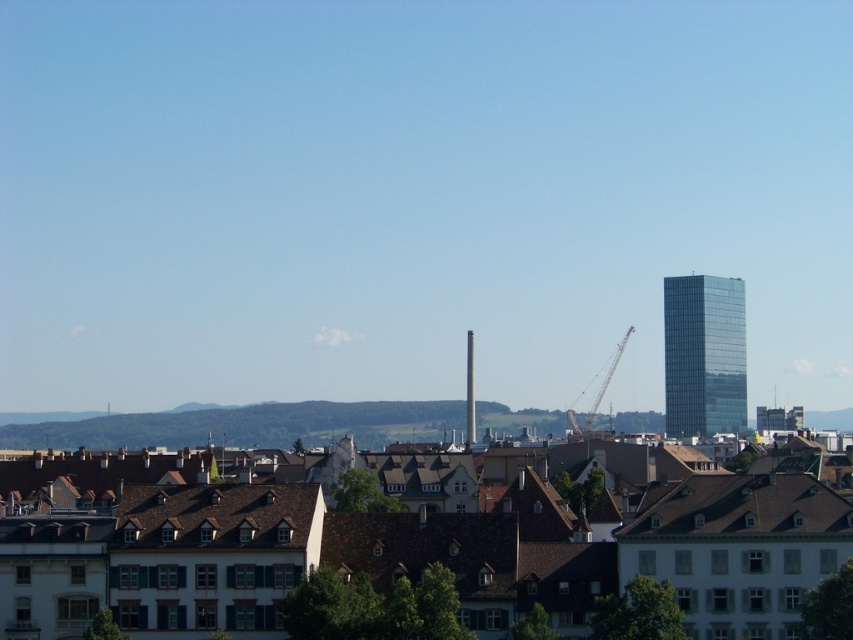
You are an architect planning to install a new billboard between the green glass tower at right and the metallic gray crane at center. Given their widths, which object should the billboard be closer to to ensure it doesn

The green glass tower at right has a lesser width compared to the metallic gray crane at center. Therefore, the billboard should be closer to the metallic gray crane at center to accommodate its larger width.

Based on the photo, what is located at the coordinates point (704,355)?

The green glass tower at right is located at point (704,355).

You are a city planner looking at the cityscape. You need to determine the visibility of the metallic gray crane at center from the main plaza located in front of the green glass tower at right. Can the crane be seen from there?

The metallic gray crane at center is behind the green glass tower at right, so it cannot be seen from the main plaza in front of the green glass tower at right.